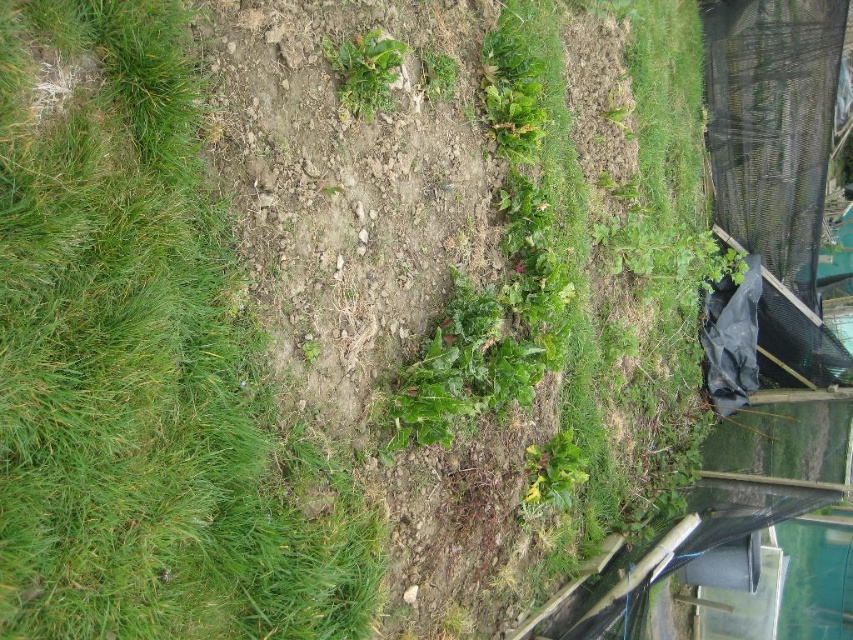
Question: Which of these objects is positioned farthest from the green leafy plant at center?

Choices:
 (A) green grass at upper left
 (B) green leafy plant at upper center

Answer: (A)

Question: Which point appears farthest from the camera in this image?

Choices:
 (A) (135, 371)
 (B) (436, 51)
 (C) (352, 61)

Answer: (B)

Question: From the image, what is the correct spatial relationship of green grass at upper left in relation to green leafy plant at upper center?

Choices:
 (A) right
 (B) left

Answer: (B)

Question: In this image, where is green grass at upper left located relative to green leafy plant at center?

Choices:
 (A) left
 (B) right

Answer: (A)

Question: Which object appears farthest from the camera in this image?

Choices:
 (A) green grass at upper left
 (B) green leafy plant at center

Answer: (B)

Question: Where is green grass at upper left located in relation to green leafy plant at upper center in the image?

Choices:
 (A) right
 (B) left

Answer: (B)